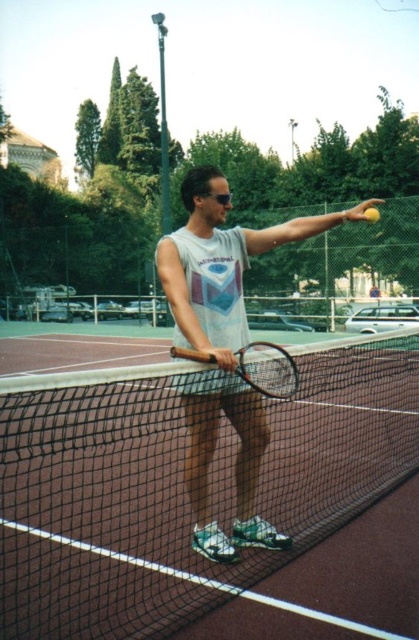
You are a photographer positioned at the baseline of the tennis court. You want to take a picture of the white cotton tank top at center without the black mesh net at center blocking it. Is this possible?

The white cotton tank top at center is behind the black mesh net at center, so it is already obscured by the net. Therefore, you cannot take a picture of the white cotton tank top at center without the black mesh net at center blocking it.

You are a tennis ball that just bounced on the clay court. You want to roll towards the black mesh net at center but need to avoid the white cotton tank top at center. Which direction should you roll to stay below both objects?

The white cotton tank top at center is taller than the black mesh net at center. To stay below both, you should roll towards the black mesh net at center since it is the shorter object between the two.

You are a tennis player standing at the net on a clay court. You see the black mesh net at center and the matte black tennis racket at center. Which object is located more to the left?

A: The black mesh net at center is positioned on the left side of the matte black tennis racket at center, so the black mesh net at center is more to the left.